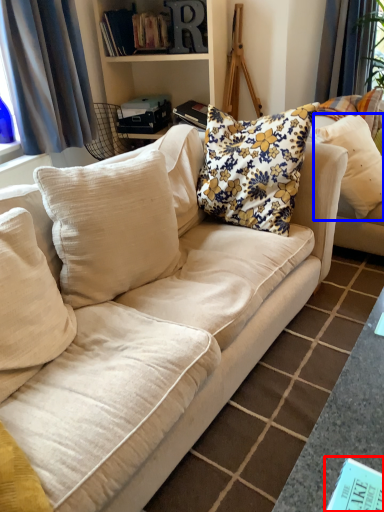
Question: Among these objects, which one is nearest to the camera, book (highlighted by a red box) or pillow (highlighted by a blue box)?

Choices:
 (A) book
 (B) pillow

Answer: (A)